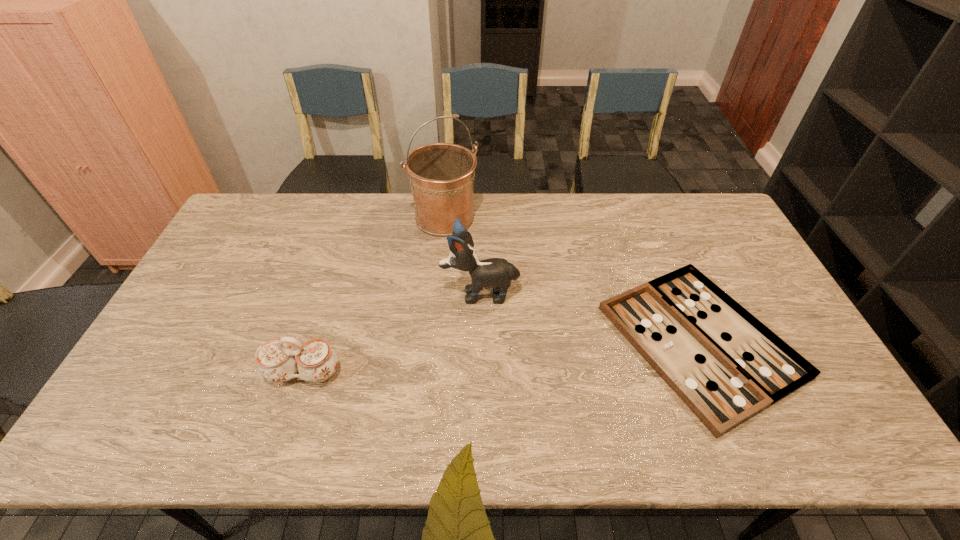
Find the location of a particular element. This screenshot has width=960, height=540. vacant space that's between the farthest object and the shortest object is located at coordinates (572, 280).

Where is `empty space between the tallest object and the leftmost object`? empty space between the tallest object and the leftmost object is located at coordinates point(374,296).

You are a GUI agent. You are given a task and a screenshot of the screen. Output one action in this format:
    pyautogui.click(x=<x>, y=<y>)
    Task: Click on the object that can be found as the closest to the gameboard
    This screenshot has width=960, height=540.
    Given the screenshot: What is the action you would take?
    pyautogui.click(x=498, y=273)

Select which object is the closest to the leftmost object. Please provide its 2D coordinates. Your answer should be formatted as a tuple, i.e. [(x, y)], where the tuple contains the x and y coordinates of a point satisfying the conditions above.

[(498, 273)]

The image size is (960, 540). What are the coordinates of `vacant space that satisfies the following two spatial constraints: 1. on the front-facing side of the third shortest object; 2. by the handle of the second shortest object` in the screenshot? It's located at (480, 373).

This screenshot has width=960, height=540. I want to click on free space that satisfies the following two spatial constraints: 1. on the front-facing side of the puppy; 2. by the handle of the chinaware, so click(480, 373).

In order to click on vacant area in the image that satisfies the following two spatial constraints: 1. on the front-facing side of the third shortest object; 2. on the left side of the rightmost object in this screenshot , I will do `click(480, 341)`.

Locate an element on the screen. Image resolution: width=960 pixels, height=540 pixels. vacant region that satisfies the following two spatial constraints: 1. on the back side of the rightmost object; 2. on the front-facing side of the puppy is located at coordinates (680, 293).

This screenshot has height=540, width=960. I want to click on blank area in the image that satisfies the following two spatial constraints: 1. on the front-facing side of the puppy; 2. by the handle of the chinaware, so click(x=480, y=373).

Locate an element on the screen. The height and width of the screenshot is (540, 960). vacant space that satisfies the following two spatial constraints: 1. on the front-facing side of the third shortest object; 2. by the handle of the leftmost object is located at coordinates (480, 373).